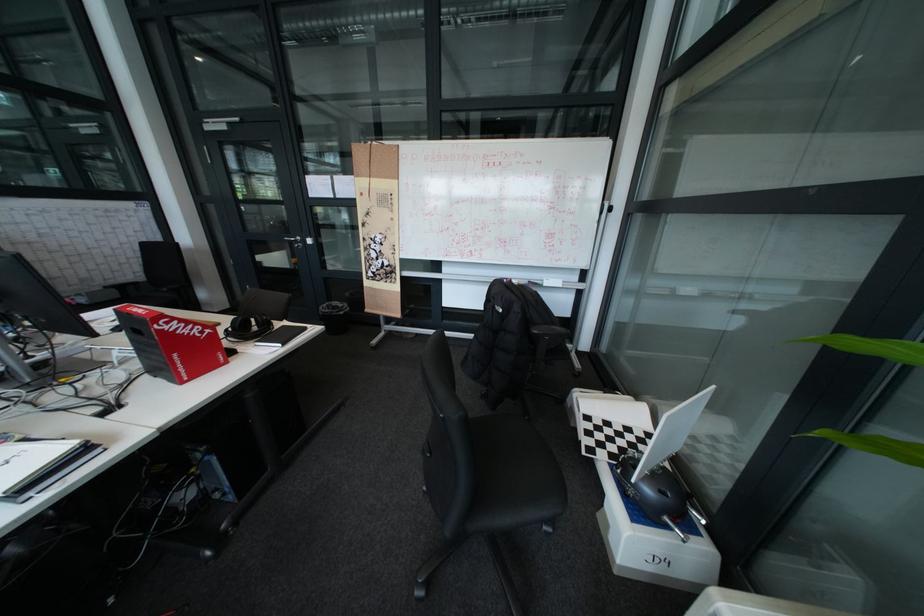
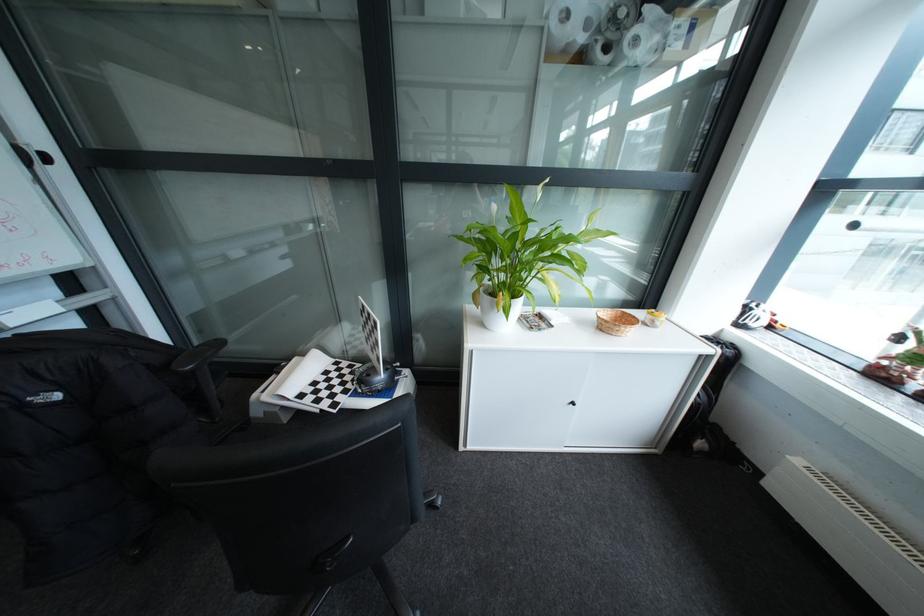
Based on the continuous images, in which direction is the camera rotating?

The camera's rotation is toward right-down.